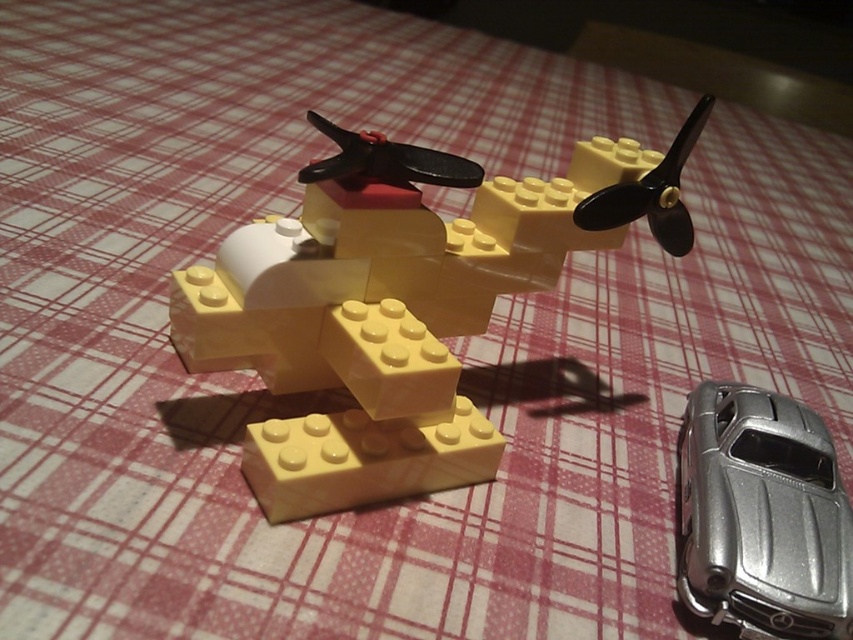
Question: Can you confirm if yellow matte airplane at center is positioned to the right of silver metallic car at lower right?

Choices:
 (A) no
 (B) yes

Answer: (A)

Question: Which object is farther from the camera taking this photo?

Choices:
 (A) silver metallic car at lower right
 (B) yellow matte airplane at center

Answer: (B)

Question: Which point is closer to the camera?

Choices:
 (A) (335, 128)
 (B) (790, 419)

Answer: (A)

Question: Does yellow matte airplane at center have a larger size compared to silver metallic car at lower right?

Choices:
 (A) yes
 (B) no

Answer: (A)

Question: Which of the following is the closest to the observer?

Choices:
 (A) coord(636,214)
 (B) coord(746,413)

Answer: (B)

Question: Can you confirm if yellow matte airplane at center is wider than silver metallic car at lower right?

Choices:
 (A) no
 (B) yes

Answer: (B)